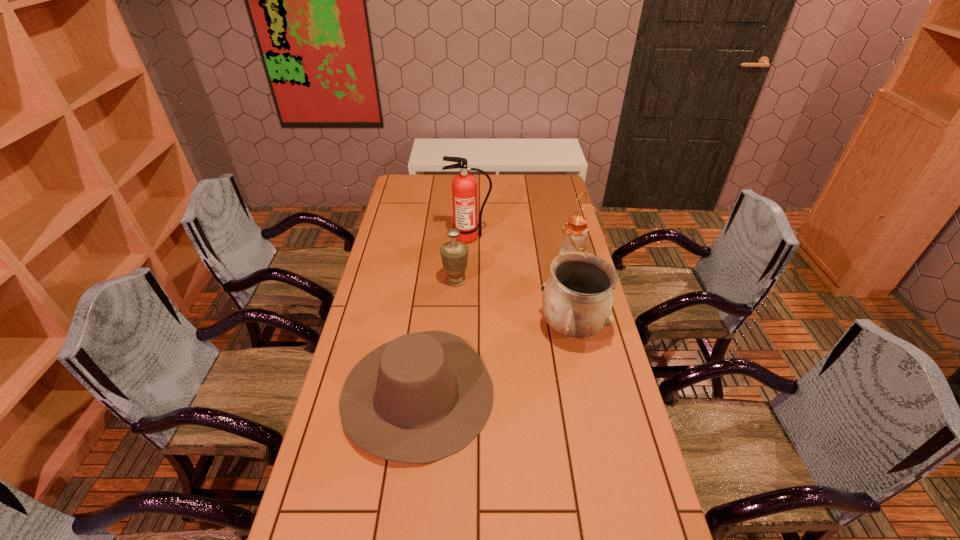
You are a GUI agent. You are given a task and a screenshot of the screen. Output one action in this format:
    pyautogui.click(x=<x>, y=<y>)
    Task: Click on the farthest object
    
    Given the screenshot: What is the action you would take?
    pyautogui.click(x=464, y=185)

Image resolution: width=960 pixels, height=540 pixels. What are the coordinates of `oil lamp` in the screenshot? It's located at (574, 233).

The image size is (960, 540). Identify the location of the right urn. (577, 301).

Locate an element on the screen. This screenshot has width=960, height=540. the farther urn is located at coordinates (454, 254).

Find the location of a particular element. cowboy hat is located at coordinates (422, 397).

Locate an element on the screen. This screenshot has width=960, height=540. vacant area located 0.170m on the handle side of the fire extinguisher is located at coordinates (468, 271).

This screenshot has width=960, height=540. Identify the location of free space located on the back of the oil lamp. (566, 248).

Where is `free region located on the left of the right urn`? The width and height of the screenshot is (960, 540). free region located on the left of the right urn is located at coordinates [473, 328].

I want to click on vacant region located on the back of the farther urn, so click(459, 226).

You are a GUI agent. You are given a task and a screenshot of the screen. Output one action in this format:
    pyautogui.click(x=<x>, y=<y>)
    Task: Click on the vacant space situated on the back of the cowboy hat
    
    Given the screenshot: What is the action you would take?
    pyautogui.click(x=433, y=269)